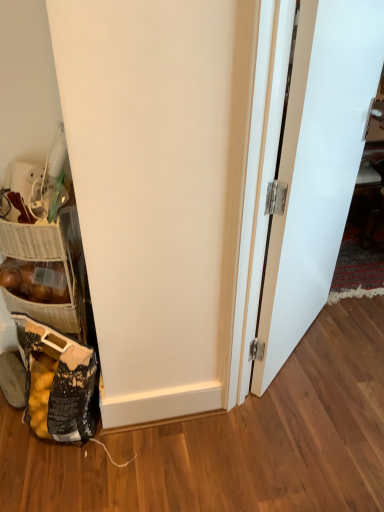
Locate an element on the screen. vacant space to the right of black plastic bag at lower left is located at coordinates (126, 457).